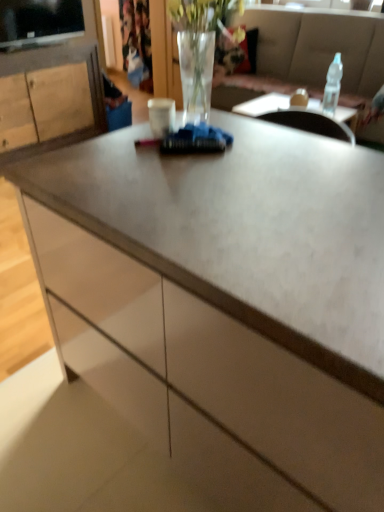
Question: Would you say clear glass vase at center is to the left or to the right of clear plastic bottle at upper right in the picture?

Choices:
 (A) left
 (B) right

Answer: (A)

Question: Is clear glass vase at center bigger or smaller than clear plastic bottle at upper right?

Choices:
 (A) big
 (B) small

Answer: (A)

Question: Based on their relative distances, which object is nearer to the clear plastic bottle at upper right?

Choices:
 (A) wooden cabinet at left
 (B) clear glass vase at center
 (C) matte gray couch at upper center
 (D) translucent glass vase at upper center
 (E) black glossy television at upper left

Answer: (C)

Question: Based on their relative distances, which object is nearer to the clear plastic bottle at upper right?

Choices:
 (A) translucent glass vase at upper center
 (B) black glossy television at upper left
 (C) matte gray couch at upper center
 (D) wooden cabinet at left
 (E) clear glass vase at center

Answer: (C)